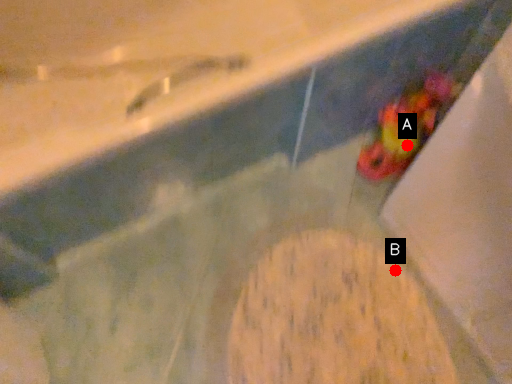
Question: Two points are circled on the image, labeled by A and B beside each circle. Which point is closer to the camera?

Choices:
 (A) A is closer
 (B) B is closer

Answer: (B)